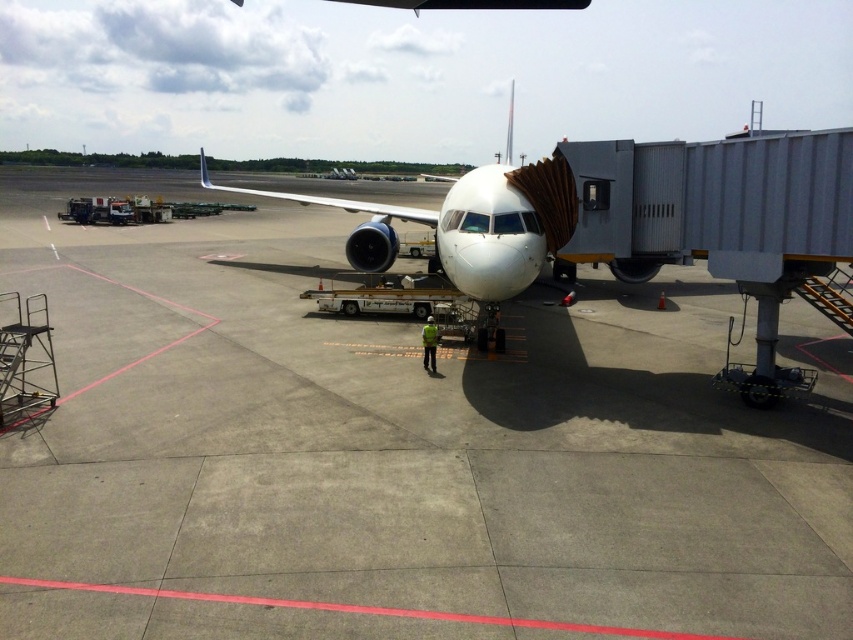
Question: Is gray concrete tarmac at center to the right of white matte airplane at center from the viewer's perspective?

Choices:
 (A) yes
 (B) no

Answer: (B)

Question: Is gray concrete tarmac at center in front of white matte airplane at center?

Choices:
 (A) yes
 (B) no

Answer: (A)

Question: Among these objects, which one is farthest from the camera?

Choices:
 (A) gray concrete tarmac at center
 (B) white matte airplane at center

Answer: (B)

Question: In this image, where is gray concrete tarmac at center located relative to white matte airplane at center?

Choices:
 (A) right
 (B) left

Answer: (B)